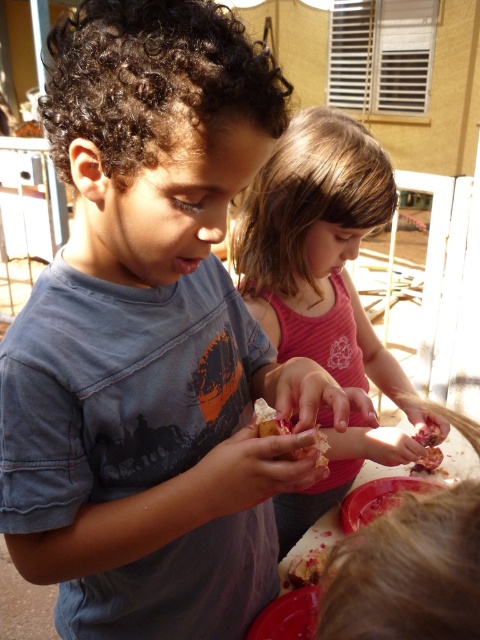
Is point (269, 460) farther from viewer compared to point (307, 448)?

No, it is in front of (307, 448).

Can you confirm if matte gray shirt at center is smaller than pink matte food at center?

No, matte gray shirt at center is not smaller than pink matte food at center.

Image resolution: width=480 pixels, height=640 pixels. What do you see at coordinates (151, 337) in the screenshot?
I see `matte gray shirt at center` at bounding box center [151, 337].

Where is `matte gray shirt at center`? matte gray shirt at center is located at coordinates (151, 337).

Does pink cotton shirt at center appear on the right side of pink glossy fruit at center?

In fact, pink cotton shirt at center is to the left of pink glossy fruit at center.

Which of these two, pink cotton shirt at center or pink glossy fruit at center, stands shorter?

pink glossy fruit at center

Identify the location of pink cotton shirt at center. The height and width of the screenshot is (640, 480). (317, 248).

The image size is (480, 640). What are the coordinates of `pink cotton shirt at center` in the screenshot? It's located at (317, 248).

Is pink matte food at center taller than pink glossy fruit at center?

In fact, pink matte food at center may be shorter than pink glossy fruit at center.

Can you confirm if pink matte food at center is thinner than pink glossy fruit at center?

Indeed, pink matte food at center has a lesser width compared to pink glossy fruit at center.

Is point (322, 436) closer to viewer compared to point (440, 449)?

Yes, point (322, 436) is in front of point (440, 449).

The height and width of the screenshot is (640, 480). Identify the location of pink matte food at center. 268,420.